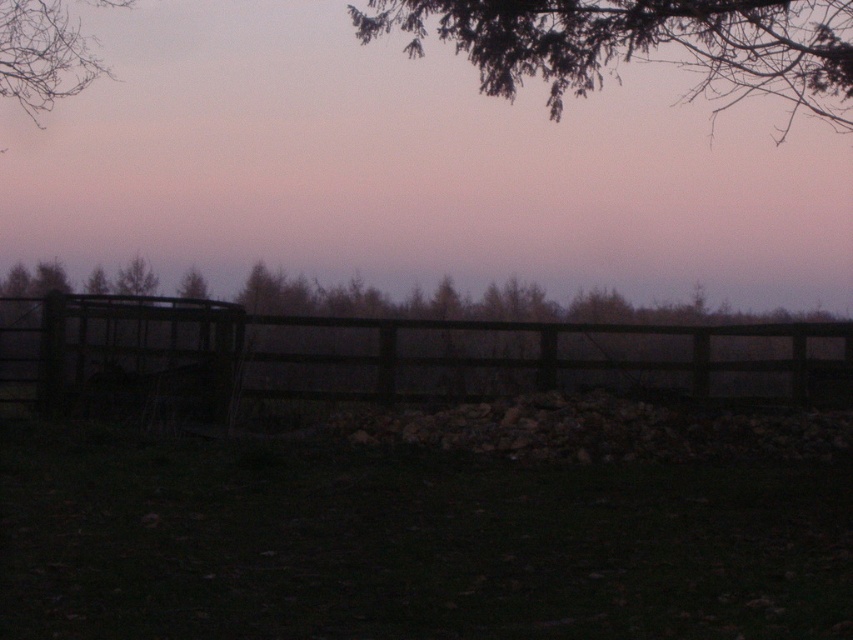
Which of these two, matte wooden fence at center or bare branches at upper left, stands shorter?

bare branches at upper left

Identify the location of matte wooden fence at center. This screenshot has width=853, height=640. (413, 168).

Who is shorter, matte wooden fence at center or green leafy branch at upper center?

Standing shorter between the two is green leafy branch at upper center.

Is point (157, 236) farther from camera compared to point (843, 8)?

No, it is in front of (843, 8).

Image resolution: width=853 pixels, height=640 pixels. In order to click on matte wooden fence at center in this screenshot , I will do `click(413, 168)`.

Measure the distance between green leafy branch at upper center and camera.

19.86 meters

Is green leafy branch at upper center wider than bare branches at upper left?

Yes, green leafy branch at upper center is wider than bare branches at upper left.

Is point (776, 56) in front of point (49, 68)?

No, it is not.

Image resolution: width=853 pixels, height=640 pixels. In order to click on green leafy branch at upper center in this screenshot , I will do `click(640, 44)`.